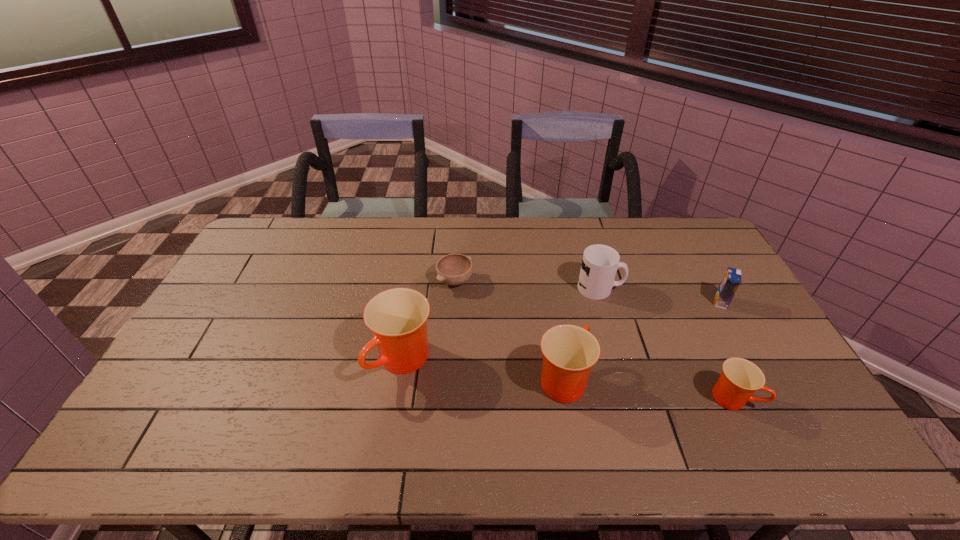
This screenshot has height=540, width=960. I want to click on blank region between the rightmost object and the fifth object from left to right, so click(727, 350).

Where is `object that is the fifth closest to the third object from right to left`? The image size is (960, 540). object that is the fifth closest to the third object from right to left is located at coordinates (397, 317).

Find the location of a particular element. This screenshot has width=960, height=540. object that can be found as the third closest to the shortest cup is located at coordinates (600, 263).

Select which cup is the second closest to the orange_juice. Please provide its 2D coordinates. Your answer should be formatted as a tuple, i.e. [(x, y)], where the tuple contains the x and y coordinates of a point satisfying the conditions above.

[(569, 352)]

Find the location of a particular element. cup that is the third closest one to the rightmost object is located at coordinates (397, 317).

Locate an element on the screen. This screenshot has height=540, width=960. free spot that satisfies the following two spatial constraints: 1. on the front side of the shortest object; 2. on the right side of the second cup from right to left is located at coordinates (x=449, y=379).